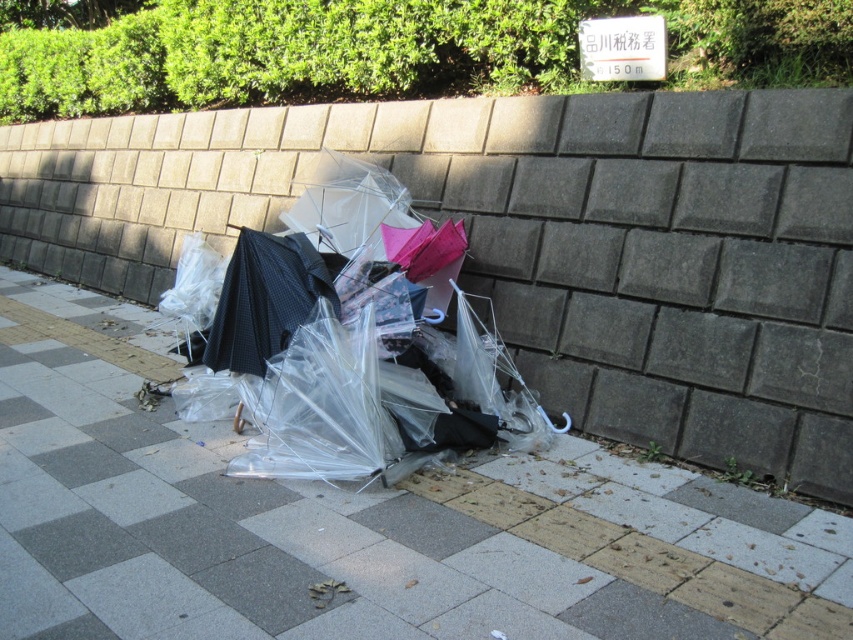
Question: Which object is the farthest from the transparent plastic umbrellas at center?

Choices:
 (A) transparent plastic umbrella at center
 (B) transparent plastic umbrellas at lower center

Answer: (B)

Question: Does transparent plastic umbrellas at center have a larger size compared to black textured umbrella at center?

Choices:
 (A) yes
 (B) no

Answer: (A)

Question: Which object is closer to the camera taking this photo?

Choices:
 (A) transparent plastic umbrellas at center
 (B) transparent plastic umbrellas at lower center

Answer: (A)

Question: Can you confirm if transparent plastic umbrellas at lower center is smaller than black textured umbrella at center?

Choices:
 (A) yes
 (B) no

Answer: (A)

Question: Which object is farther from the camera taking this photo?

Choices:
 (A) transparent plastic umbrellas at lower center
 (B) transparent plastic umbrella at center
 (C) transparent plastic umbrellas at center
 (D) black textured umbrella at center

Answer: (A)

Question: Can you confirm if transparent plastic umbrellas at lower center is wider than transparent plastic umbrellas at center?

Choices:
 (A) no
 (B) yes

Answer: (A)